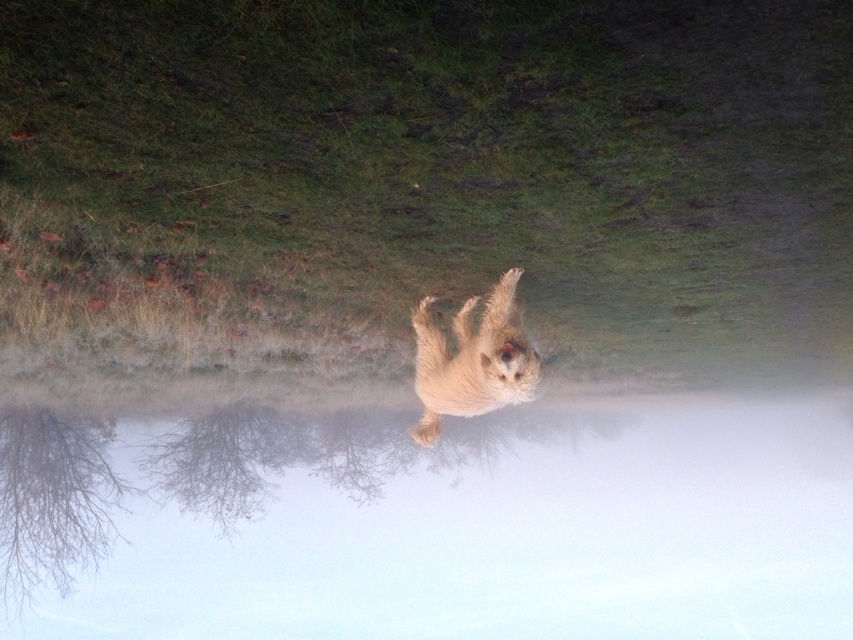
Is foggy water at center wider than fuzzy fur dog at center?

Correct, the width of foggy water at center exceeds that of fuzzy fur dog at center.

Does foggy water at center appear on the right side of fuzzy fur dog at center?

Indeed, foggy water at center is positioned on the right side of fuzzy fur dog at center.

Who is more forward, (321, 516) or (422, 326)?

Point (422, 326) is in front.

Find the location of `foggy water at center`. foggy water at center is located at coordinates (437, 522).